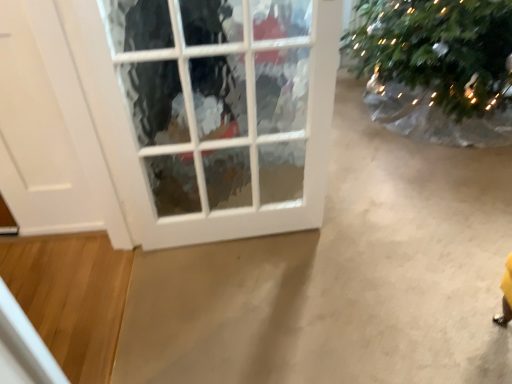
What are the coordinates of `free location to the right of white glass window at center` in the screenshot? It's located at pyautogui.click(x=355, y=254).